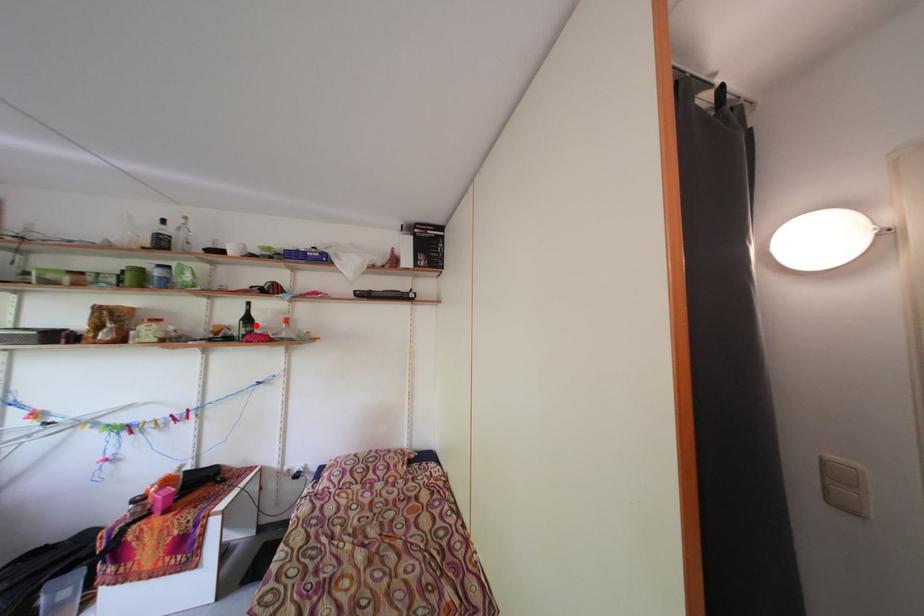
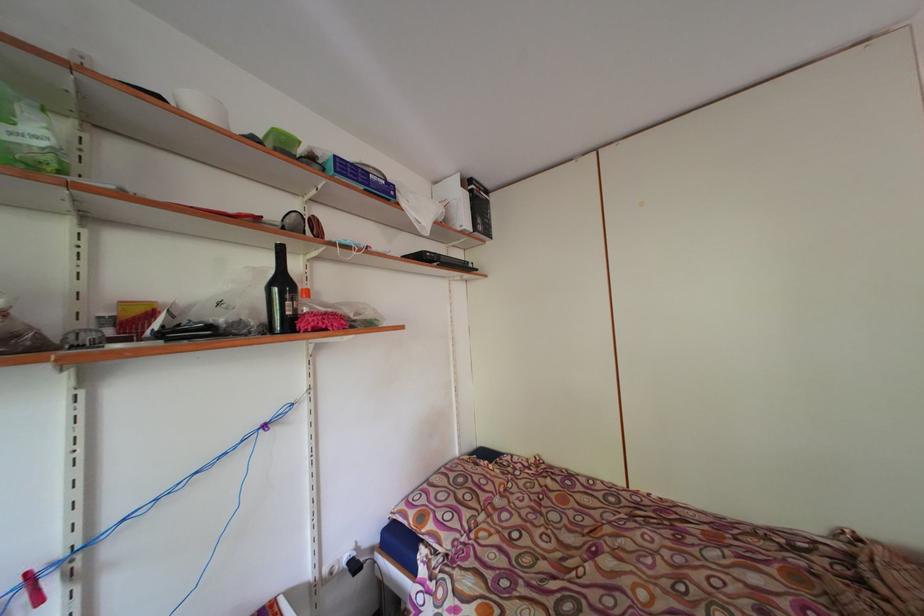
Find the pixel in the second image that matches the highlighted location in the first image.

(290, 289)